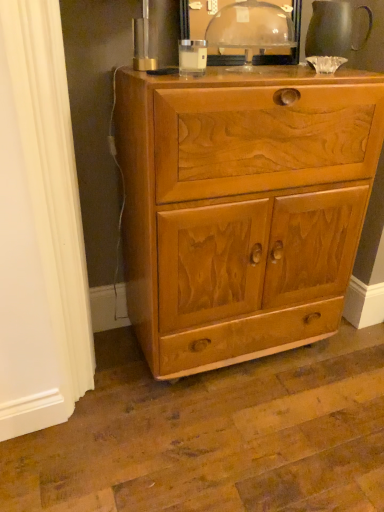
Question: Should I look upward or downward to see transparent plastic dome at upper center?

Choices:
 (A) down
 (B) up

Answer: (B)

Question: Is matte gray pitcher at upper right completely or partially outside of transparent plastic dome at upper center?

Choices:
 (A) no
 (B) yes

Answer: (B)

Question: Is matte gray pitcher at upper right positioned before transparent plastic dome at upper center?

Choices:
 (A) yes
 (B) no

Answer: (B)

Question: Considering the relative positions of matte gray pitcher at upper right and transparent plastic dome at upper center in the image provided, is matte gray pitcher at upper right to the right of transparent plastic dome at upper center from the viewer's perspective?

Choices:
 (A) yes
 (B) no

Answer: (A)

Question: Considering the relative positions of matte gray pitcher at upper right and transparent plastic dome at upper center in the image provided, is matte gray pitcher at upper right to the left of transparent plastic dome at upper center from the viewer's perspective?

Choices:
 (A) yes
 (B) no

Answer: (B)

Question: Is matte gray pitcher at upper right oriented away from transparent plastic dome at upper center?

Choices:
 (A) yes
 (B) no

Answer: (B)

Question: Does matte gray pitcher at upper right turn towards transparent plastic dome at upper center?

Choices:
 (A) no
 (B) yes

Answer: (A)

Question: Is matte gray pitcher at upper right completely or partially outside of light brown wood cabinet at center?

Choices:
 (A) yes
 (B) no

Answer: (A)

Question: Does matte gray pitcher at upper right appear on the right side of light brown wood cabinet at center?

Choices:
 (A) yes
 (B) no

Answer: (A)

Question: Is matte gray pitcher at upper right oriented away from light brown wood cabinet at center?

Choices:
 (A) yes
 (B) no

Answer: (B)

Question: Can you confirm if matte gray pitcher at upper right is bigger than light brown wood cabinet at center?

Choices:
 (A) no
 (B) yes

Answer: (A)

Question: Is matte gray pitcher at upper right positioned before light brown wood cabinet at center?

Choices:
 (A) no
 (B) yes

Answer: (A)

Question: Does matte gray pitcher at upper right have a lesser height compared to light brown wood cabinet at center?

Choices:
 (A) no
 (B) yes

Answer: (B)

Question: Is light brown wood cabinet at center outside of matte gray pitcher at upper right?

Choices:
 (A) no
 (B) yes

Answer: (B)